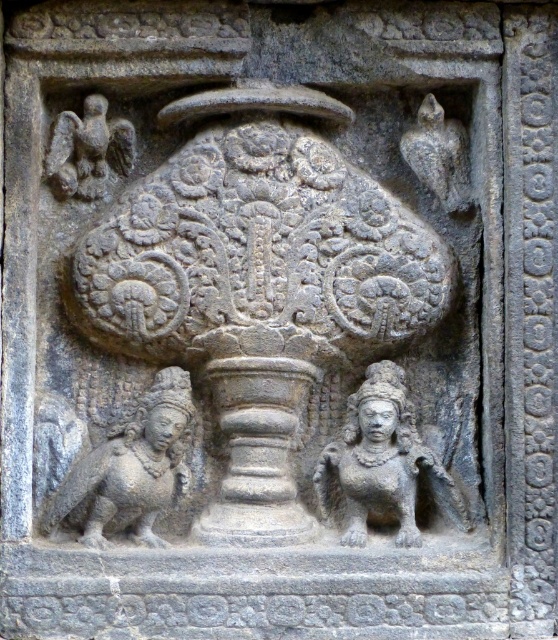
Question: Is gray stone bird at left wider than gray stone eagle at upper right?

Choices:
 (A) yes
 (B) no

Answer: (A)

Question: Can you confirm if gray stone bird at left is wider than dark gray stone eagle at upper left?

Choices:
 (A) no
 (B) yes

Answer: (B)

Question: Among these objects, which one is farthest from the camera?

Choices:
 (A) dark gray stone eagle at upper left
 (B) gray stone bird at left
 (C) gray stone vase at center

Answer: (A)

Question: Which object appears closest to the camera in this image?

Choices:
 (A) dark gray stone eagle at upper left
 (B) gray stone bird at left

Answer: (B)

Question: Among these objects, which one is farthest from the camera?

Choices:
 (A) gray stone deity at lower right
 (B) dark gray stone eagle at upper left

Answer: (B)

Question: Can you confirm if gray stone bird at left is positioned above gray stone eagle at upper right?

Choices:
 (A) no
 (B) yes

Answer: (A)